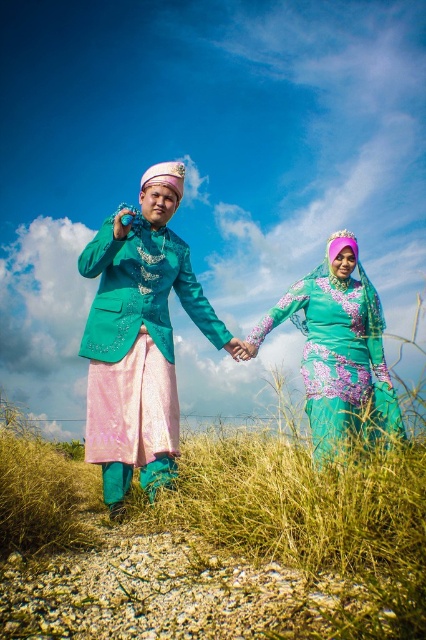
Question: Can you confirm if satin teal dress at center is thinner than teal floral dress at center?

Choices:
 (A) no
 (B) yes

Answer: (A)

Question: Can you confirm if satin teal dress at center is positioned to the left of teal floral dress at center?

Choices:
 (A) yes
 (B) no

Answer: (A)

Question: Which point is farther to the camera?

Choices:
 (A) (129, 472)
 (B) (359, 396)

Answer: (B)

Question: Is satin teal dress at center to the right of teal floral dress at center from the viewer's perspective?

Choices:
 (A) yes
 (B) no

Answer: (B)